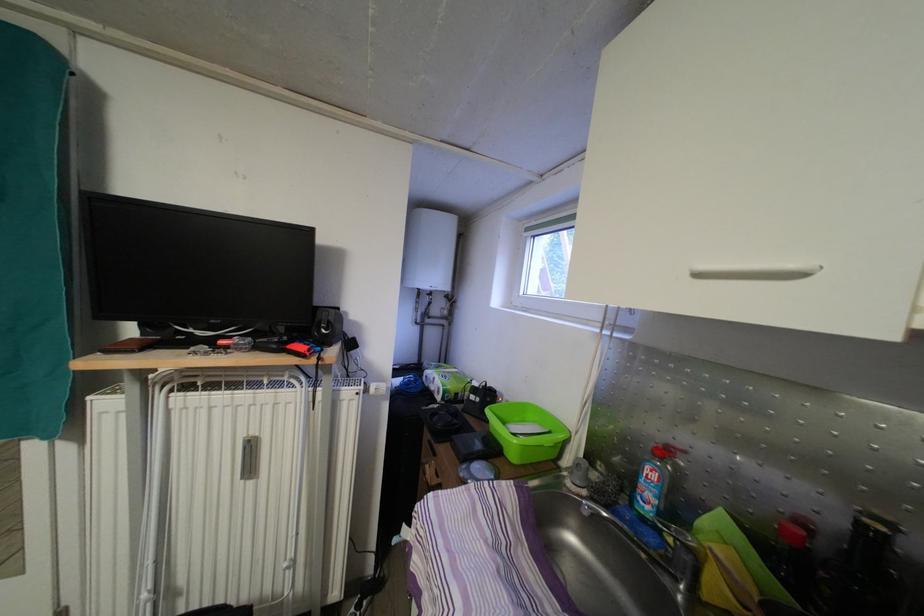
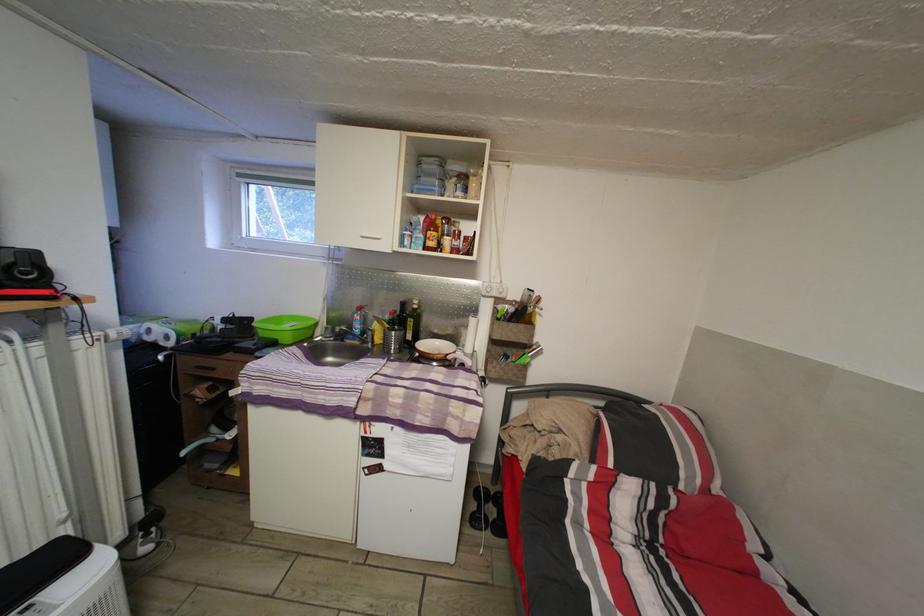
Find the pixel in the second image that matches point (706, 282) in the first image.

(370, 244)